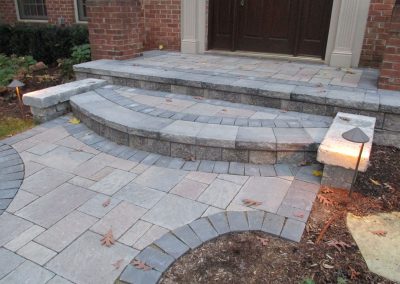
Locate an element on the screen. This screenshot has width=400, height=284. window is located at coordinates (85, 13), (38, 7).